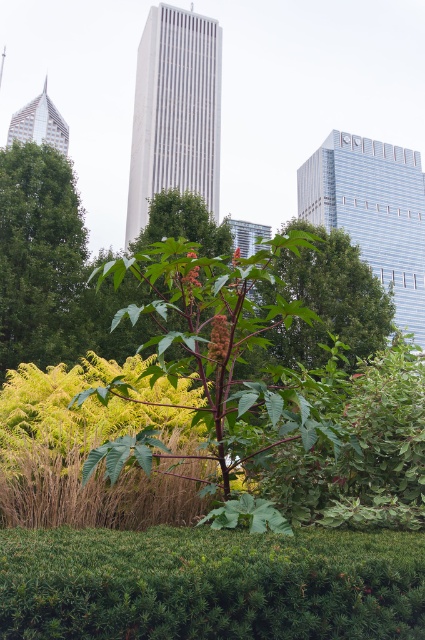
You are a gardener observing the urban park scene. You need to determine which object occupies more space in the image. Which one is bigger between the green leafy tree at left and the glossy red flower at center?

The green leafy tree at left is larger in size compared to the glossy red flower at center, so it occupies more space in the image.

Consider the image. Based on the provided scene description, what are the coordinates of the green leafy tree at center?

The green leafy tree at center is located at coordinates (325, 301).

You are standing in the urban park scene described, and you want to place a 1.5 meter tall statue exactly at the point marked as point (34, 316). Considering the distance from the camera, will the statue be visible to someone standing at the camera position?

The point (34, 316) is 18.18 meters away from the camera. Since the statue is only 1.5 meters tall, it might be too small to be clearly visible from that distance, especially in a busy park scene with other elements like trees and skyscrapers in the background. However, its exact visibility could depend on factors like lighting and the observer